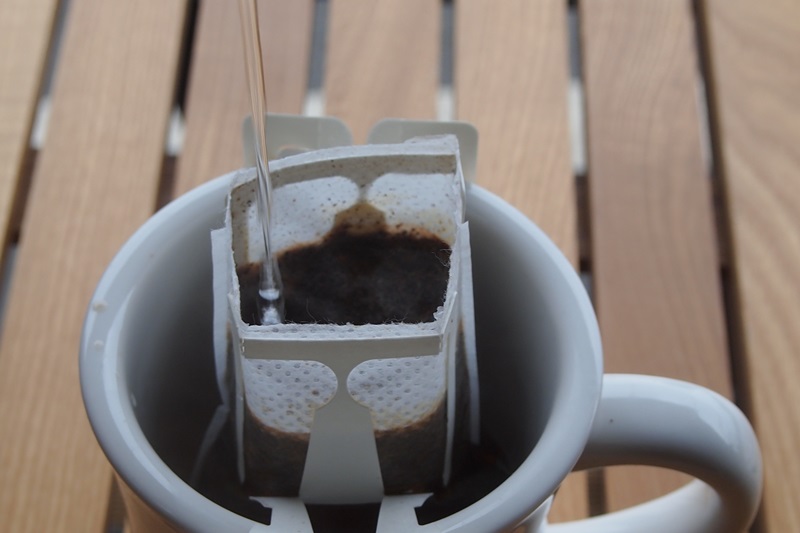
I want to click on wooden planks, so click(x=754, y=139), click(x=632, y=120), click(x=498, y=60), click(x=349, y=63), click(x=208, y=72), click(x=97, y=72), click(x=14, y=45).